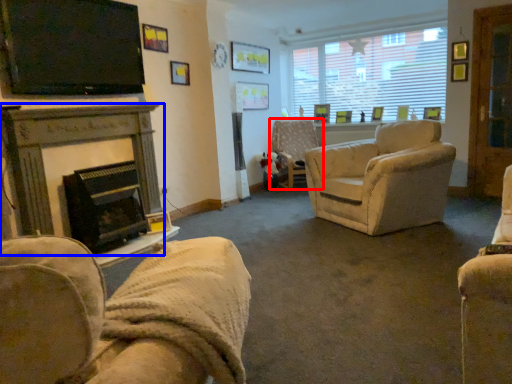
Question: Which object appears closest to the camera in this image, chair (highlighted by a red box) or fireplace (highlighted by a blue box)?

Choices:
 (A) chair
 (B) fireplace

Answer: (B)